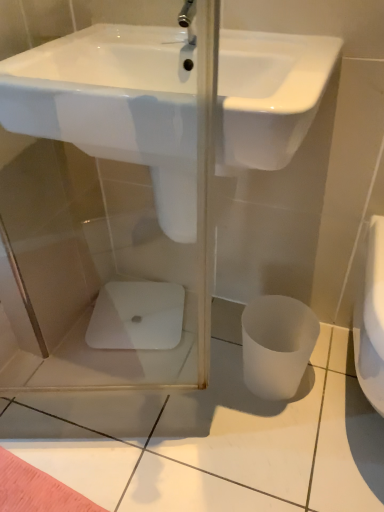
Locate an element on the screen. This screenshot has height=512, width=384. empty space that is ontop of white glossy porcelain at center is located at coordinates (144, 307).